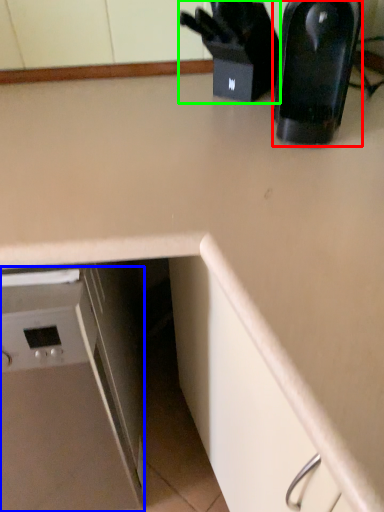
Question: Which is nearer to the kitchen appliance (highlighted by a red box)? home appliance (highlighted by a blue box) or appliance (highlighted by a green box).

Choices:
 (A) home appliance
 (B) appliance

Answer: (B)